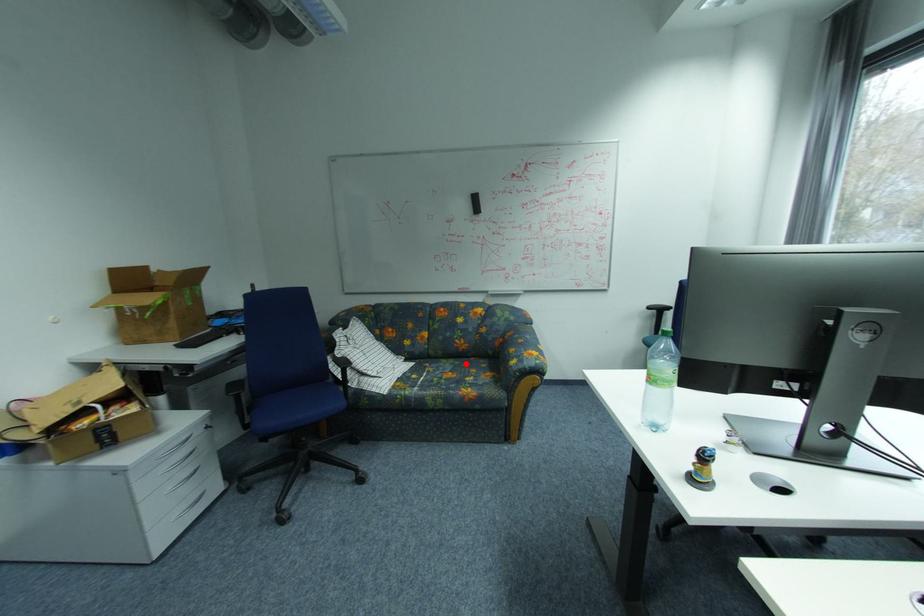
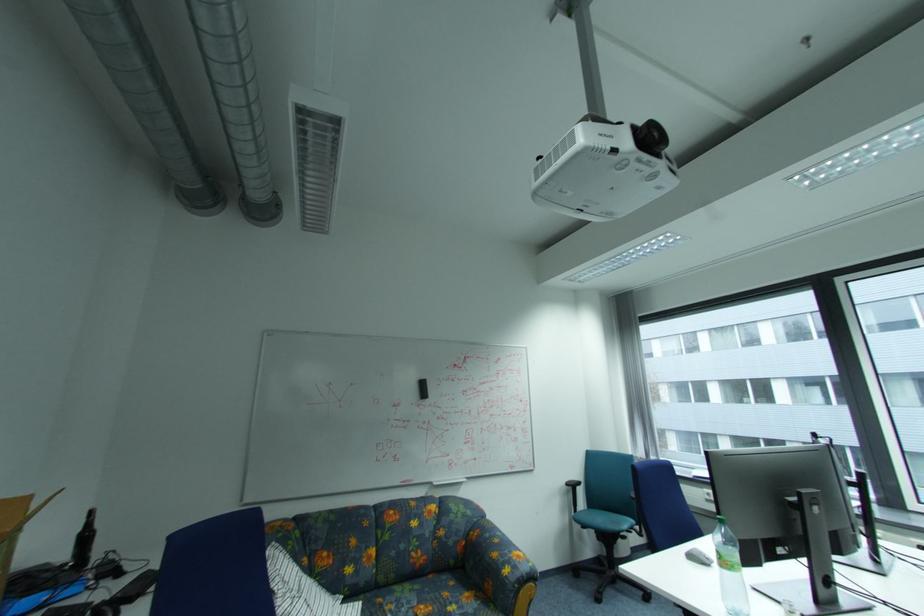
In the second image, find the point that corresponds to the highlighted location in the first image.

(424, 589)